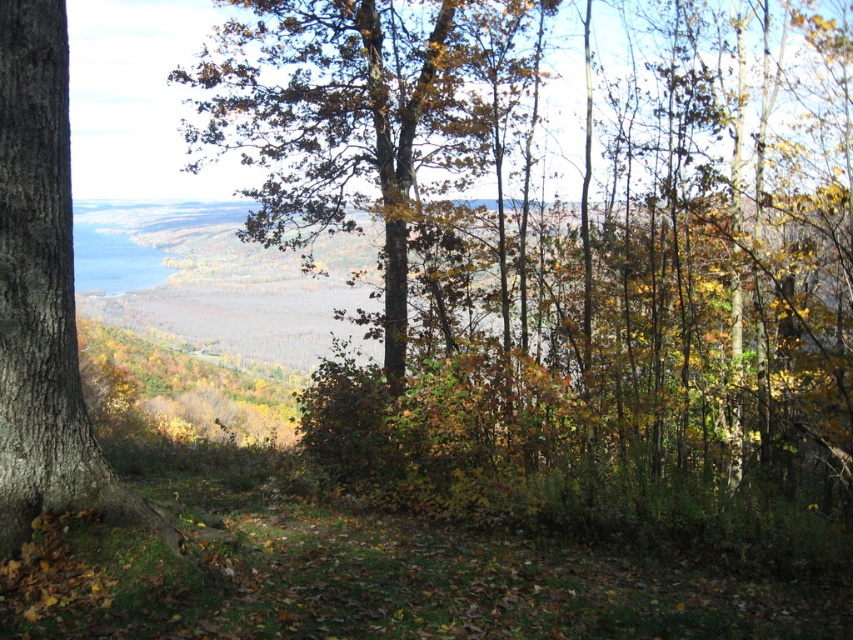
You are an artist sketching this autumn scene. You want to draw the brown textured tree at center and the brown rough tree trunk at left. Which one should you sketch first if you are following the natural order from left to right?

The brown rough tree trunk at left should be sketched first because it is positioned to the left of the brown textured tree at center.

You are planning to place a small wooden bench between the brown textured tree at center and the brown rough tree trunk at left. Given their widths, which tree will allow more space on its side for the bench?

The brown textured tree at center has a larger width than the brown rough tree trunk at left, so placing the bench next to the brown textured tree at center would provide more space.